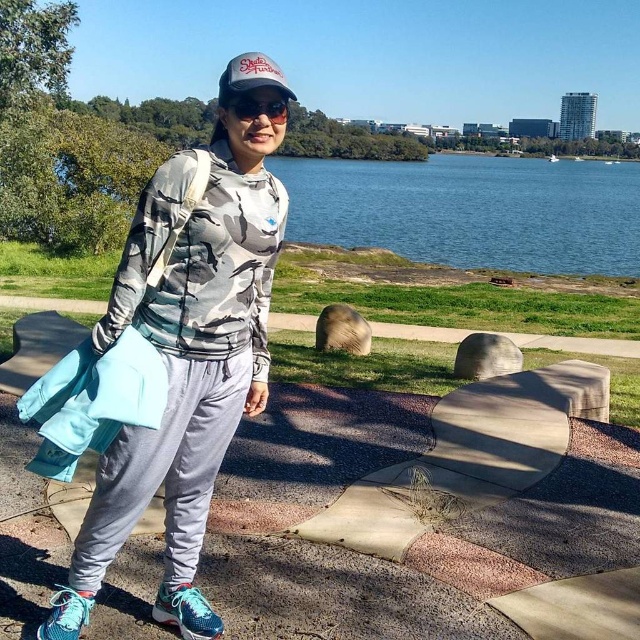
In the scene shown: Does camo fabric hoodie at center appear under black plastic goggles at center?

Correct, camo fabric hoodie at center is located below black plastic goggles at center.

Can you confirm if camo fabric hoodie at center is wider than black plastic goggles at center?

Yes.

Is point (221, 429) farther from viewer compared to point (272, 118)?

Yes, point (221, 429) is farther from viewer.

Where is `camo fabric hoodie at center`? This screenshot has width=640, height=640. camo fabric hoodie at center is located at coordinates (188, 353).

How far apart are camo fabric hoodie at center and blue water at center?

camo fabric hoodie at center is 42.30 meters from blue water at center.

Which is in front, point (140, 289) or point (561, 228)?

Point (140, 289) is in front.

Find the location of a particular element. The image size is (640, 640). camo fabric hoodie at center is located at coordinates (188, 353).

Is point (294, 161) positioned behind point (248, 97)?

Yes, it is behind point (248, 97).

From the picture: Who is more distant from viewer, (488, 248) or (237, 113)?

Point (488, 248)

The width and height of the screenshot is (640, 640). I want to click on blue water at center, so click(x=472, y=211).